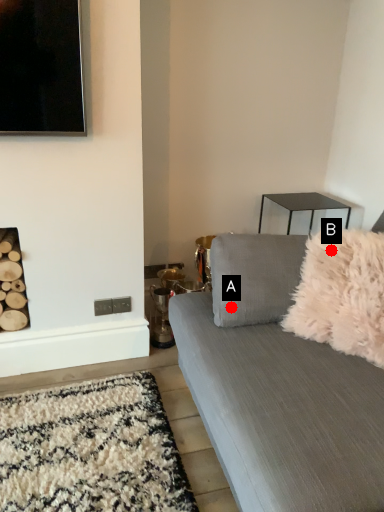
Question: Two points are circled on the image, labeled by A and B beside each circle. Among these points, which one is nearest to the camera?

Choices:
 (A) A is closer
 (B) B is closer

Answer: (B)